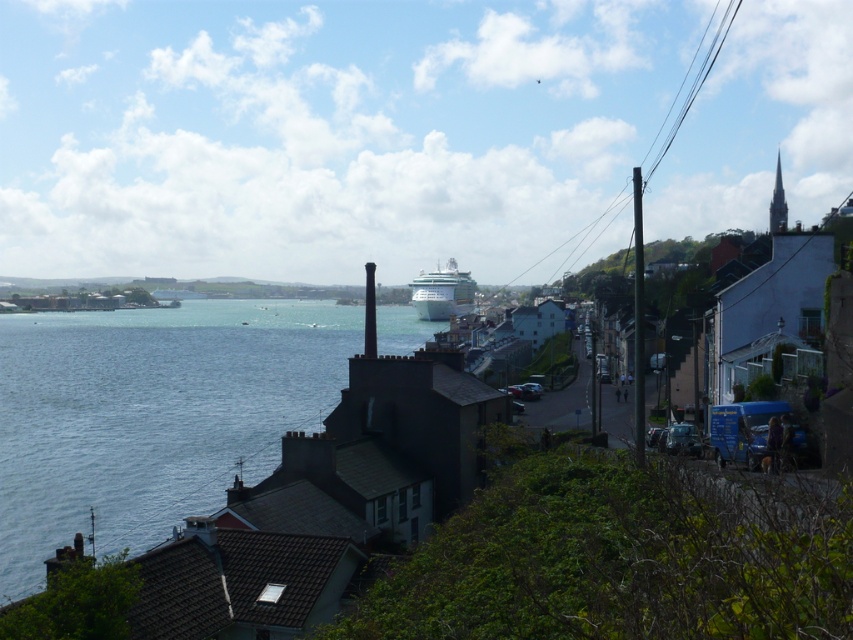
You are a photographer standing on the shore of the coastal town. You want to capture a photo where the blue water at lower left and the white glossy cruise ship at center are both visible. Which object will appear larger in the photo?

The blue water at lower left will appear larger in the photo because it is much taller than the white glossy cruise ship at center.

You are a tourist standing on the shore looking at the blue water at lower left and the white glossy cruise ship at center. Which object is positioned to the left of the other?

The blue water at lower left is to the left of the white glossy cruise ship at center according to the description.

You are standing at the point marked by the coordinates point (151, 416) in the coastal town scene. What is the immediate environment around you?

The point (151, 416) corresponds to blue water at lower left, so you are standing in the blue water at lower left.